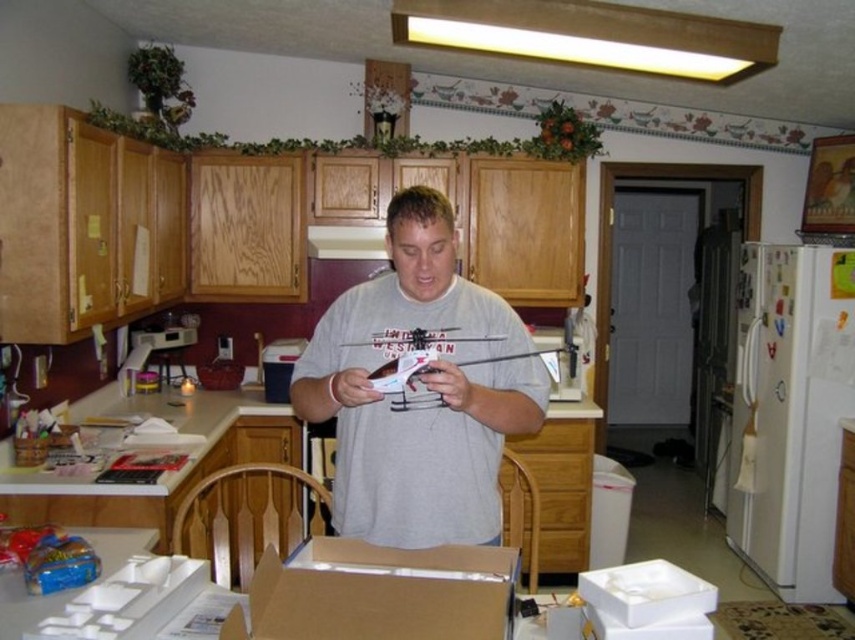
Question: Can you confirm if gray matte shirt at center is positioned below white matte box at lower right?

Choices:
 (A) no
 (B) yes

Answer: (A)

Question: Is gray matte shirt at center thinner than white glossy exhaust hood at upper center?

Choices:
 (A) no
 (B) yes

Answer: (A)

Question: Does gray matte shirt at center appear over white glossy exhaust hood at upper center?

Choices:
 (A) no
 (B) yes

Answer: (A)

Question: Among these points, which one is nearest to the camera?

Choices:
 (A) (653, 604)
 (B) (447, 632)
 (C) (380, 234)

Answer: (B)

Question: Which point is closer to the camera?

Choices:
 (A) white matte box at lower right
 (B) cardboard at lower center

Answer: (B)

Question: Among these points, which one is nearest to the camera?

Choices:
 (A) (694, 588)
 (B) (331, 588)
 (C) (379, 230)

Answer: (B)